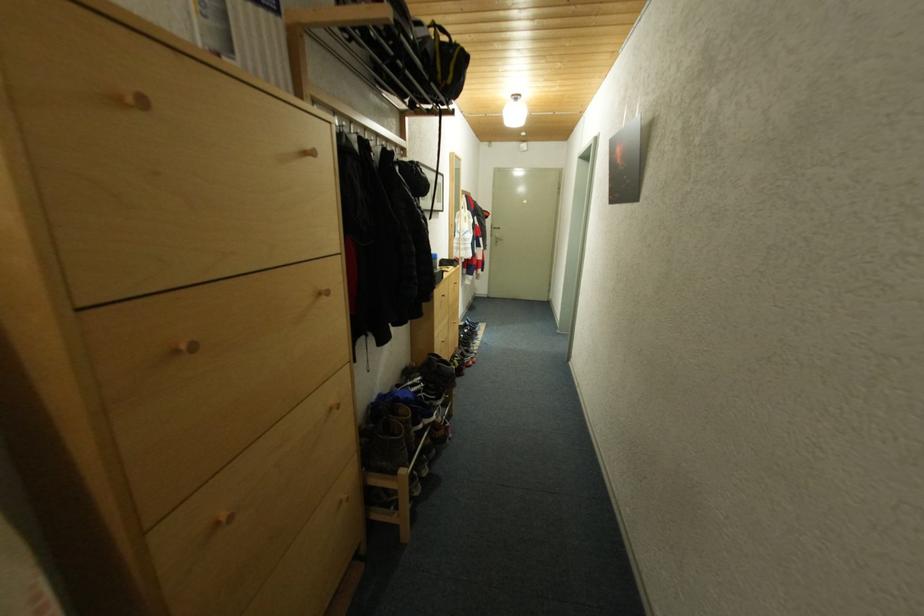
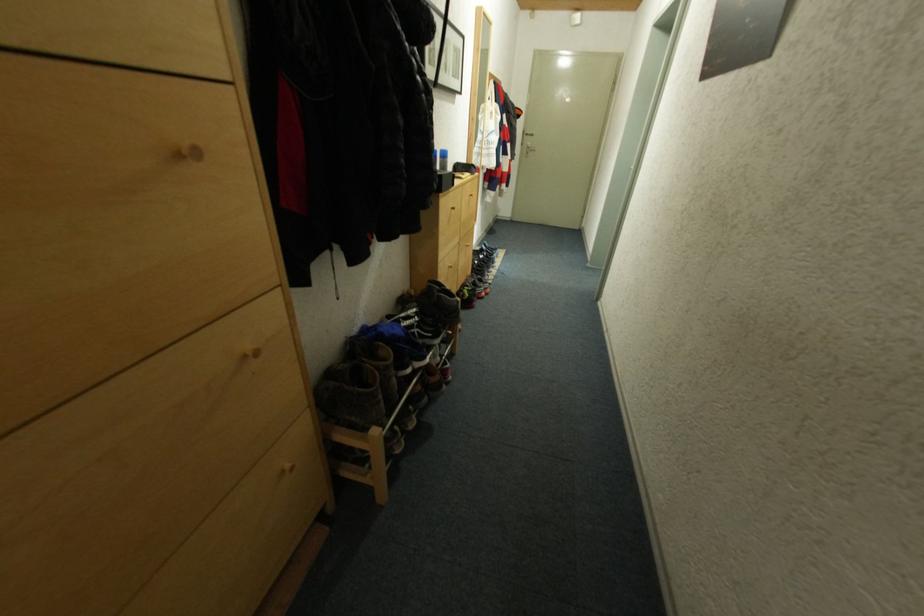
Question: Which direction would the cameraman need to move to produce the second image? Reply with the corresponding letter.

Choices:
 (A) Left
 (B) Right
 (C) Forward
 (D) Backward

Answer: (C)